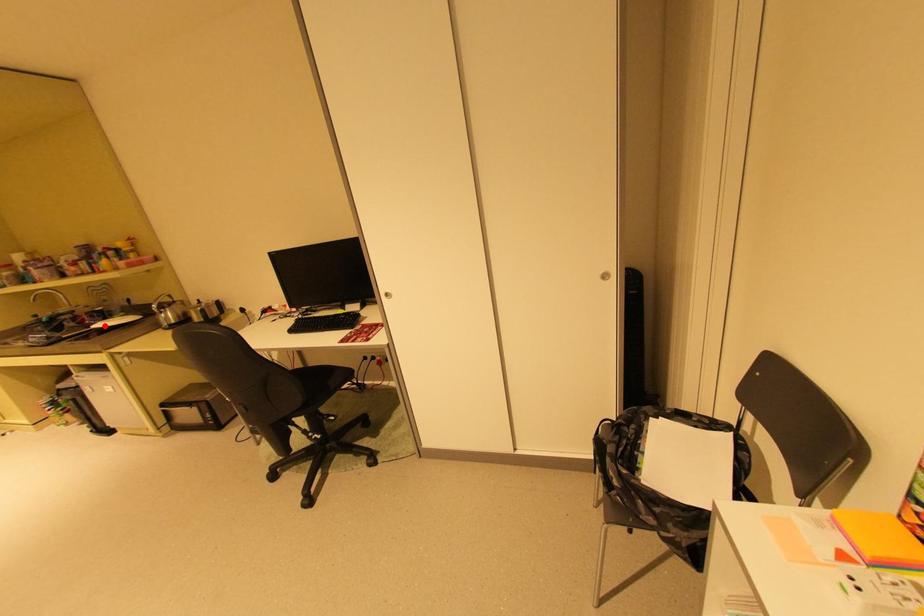
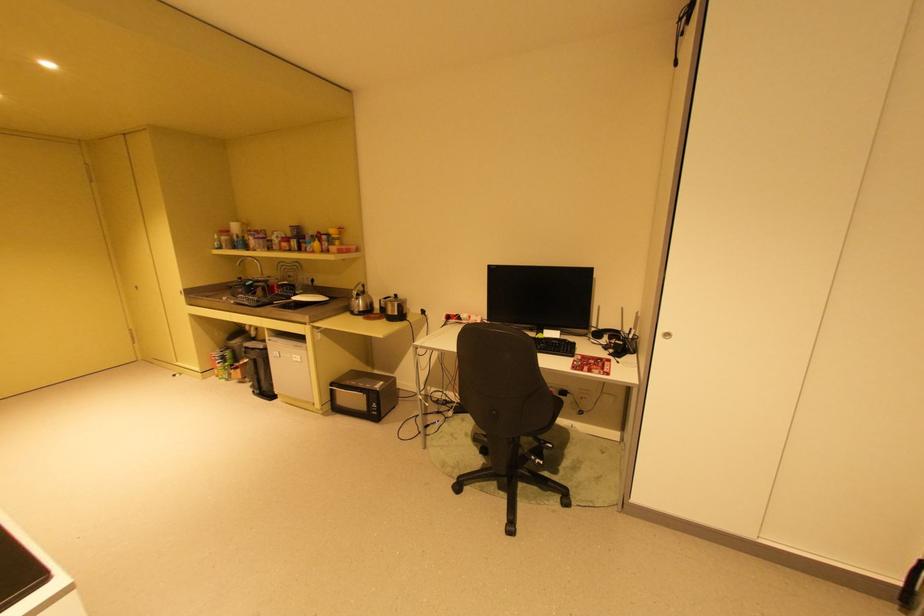
Where in the second image is the point corresponding to the highlighted location from the first image?

(304, 299)